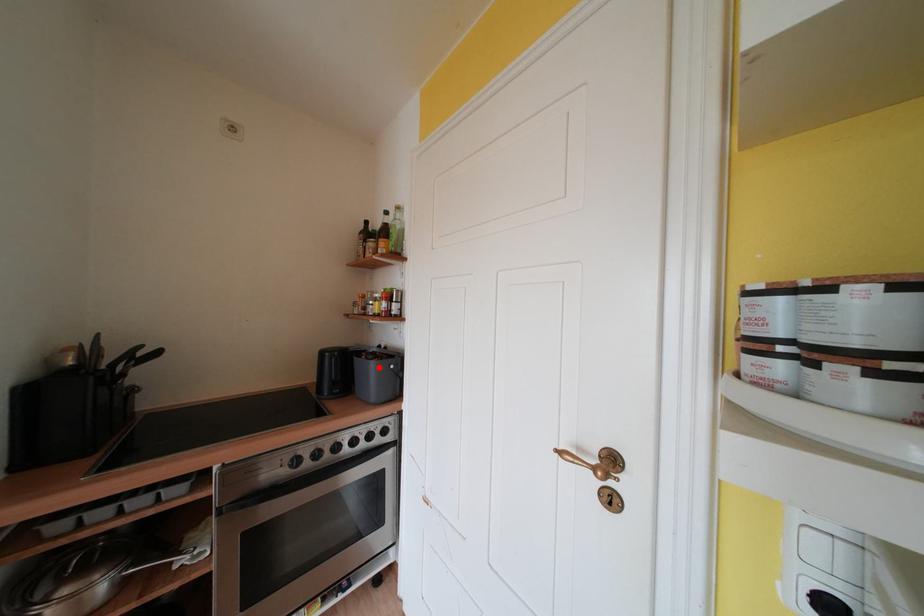
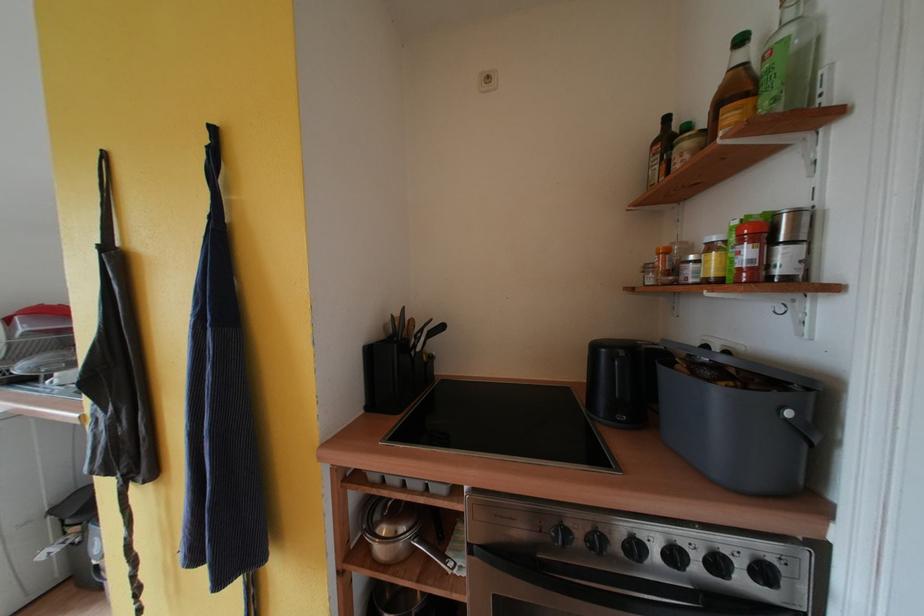
Locate, in the second image, the point that corresponds to the highlighted location in the first image.

(723, 397)